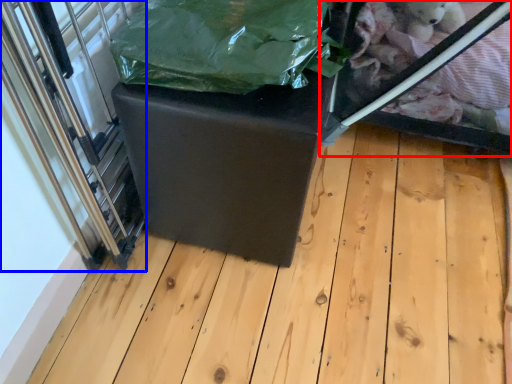
Question: Which object is closer to the camera taking this photo, glass box (highlighted by a red box) or glass door (highlighted by a blue box)?

Choices:
 (A) glass box
 (B) glass door

Answer: (B)